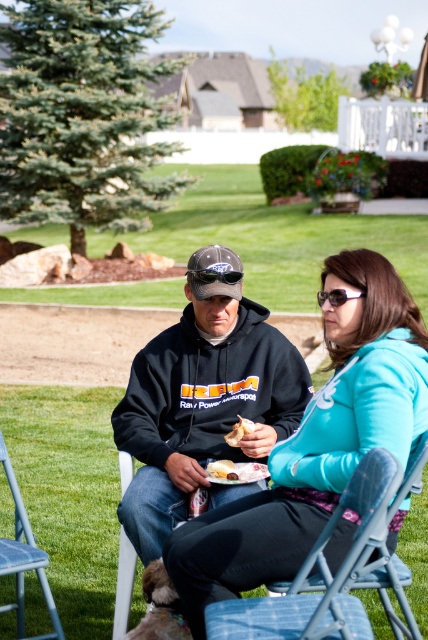
Question: Based on their relative distances, which object is nearer to the green grass at center?

Choices:
 (A) blue fabric chair at lower right
 (B) white paper plate at center

Answer: (A)

Question: Is teal fleece jacket at center thinner than black hoodie at center?

Choices:
 (A) no
 (B) yes

Answer: (A)

Question: Does green grass at center appear over blue fabric chair at lower right?

Choices:
 (A) yes
 (B) no

Answer: (A)

Question: Which object is the closest to the blue fabric chair at lower right?

Choices:
 (A) black reflective sunglasses at center
 (B) white plastic sunglasses at center
 (C) teal fleece jacket at center

Answer: (C)

Question: Which point is closer to the camera taking this photo?

Choices:
 (A) (237, 442)
 (B) (237, 166)

Answer: (A)

Question: Considering the relative positions of green grass at center and white paper plate at center in the image provided, where is green grass at center located with respect to white paper plate at center?

Choices:
 (A) above
 (B) below

Answer: (A)